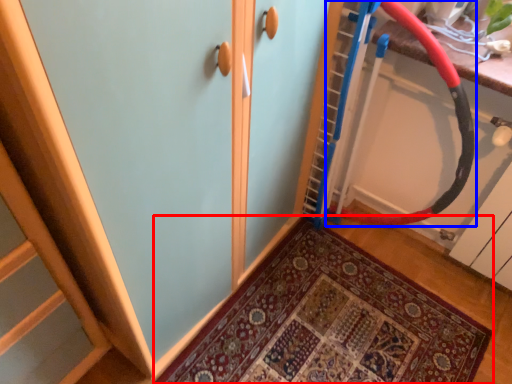
Question: Among these objects, which one is farthest to the camera, door (highlighted by a red box) or battle rope (highlighted by a blue box)?

Choices:
 (A) door
 (B) battle rope

Answer: (A)